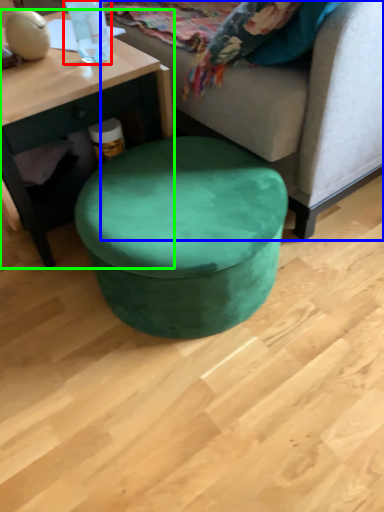
Question: Which object is positioned farthest from bottle (highlighted by a red box)? Select from studio couch (highlighted by a blue box) and coffee table (highlighted by a green box).

Choices:
 (A) studio couch
 (B) coffee table

Answer: (A)